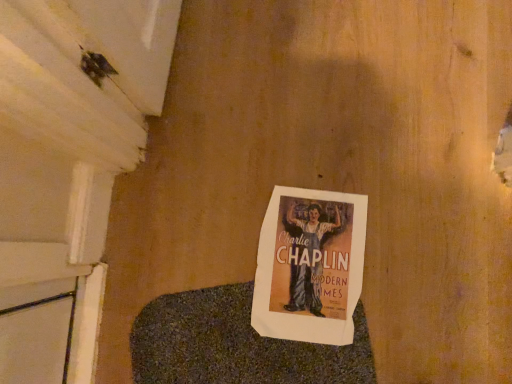
Where is `vacant position to the left of matte paper poster at center`? This screenshot has width=512, height=384. vacant position to the left of matte paper poster at center is located at coordinates (199, 274).